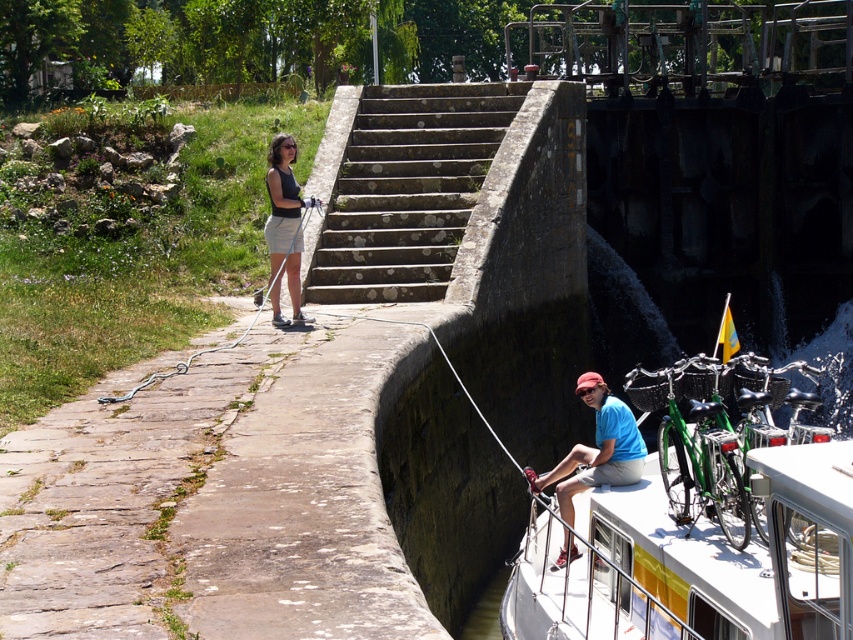
Does stone steps at center have a larger size compared to blue cotton shirt at upper right?

Correct, stone steps at center is larger in size than blue cotton shirt at upper right.

Can you confirm if stone steps at center is positioned to the right of blue cotton shirt at upper right?

In fact, stone steps at center is to the left of blue cotton shirt at upper right.

Locate an element on the screen. The image size is (853, 640). stone steps at center is located at coordinates (407, 189).

Who is higher up, stone steps at center or matte black tank top at center?

Positioned higher is stone steps at center.

Is stone steps at center to the right of matte black tank top at center from the viewer's perspective?

Yes, stone steps at center is to the right of matte black tank top at center.

Is point (387, 182) closer to viewer compared to point (280, 218)?

No, it is not.

Find the location of `stone steps at center`. stone steps at center is located at coordinates (407, 189).

Does white glossy boat at lower right have a larger size compared to white rubber rope at left?

Yes.

Consider the image. Does white glossy boat at lower right have a lesser height compared to white rubber rope at left?

No.

Identify the location of white glossy boat at lower right. This screenshot has width=853, height=640. (697, 561).